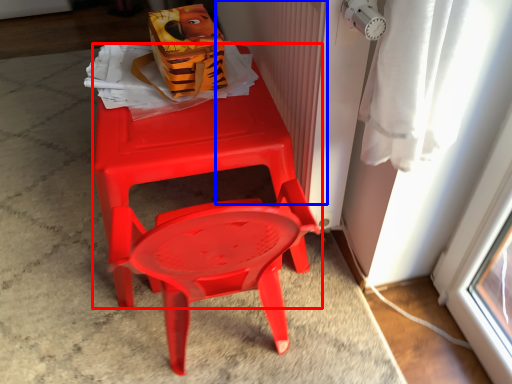
Question: Which object appears farthest to the camera in this image, chair (highlighted by a red box) or radiator (highlighted by a blue box)?

Choices:
 (A) chair
 (B) radiator

Answer: (A)